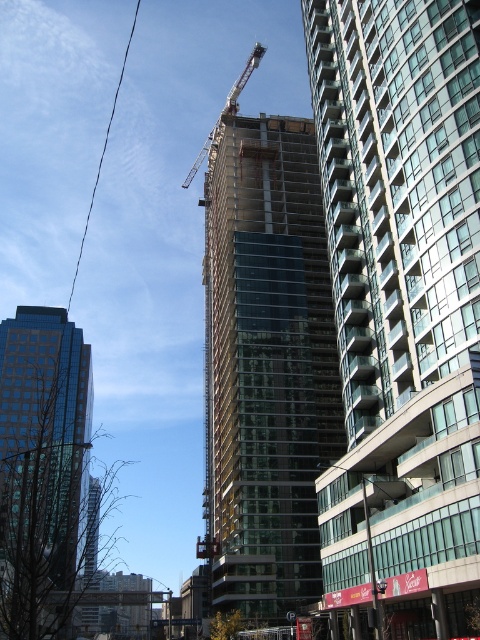
Question: Which of these objects is positioned farthest from the transparent glass building at center?

Choices:
 (A) shiny glass skyscraper at left
 (B) metallic gray crane at upper center

Answer: (B)

Question: Observing the image, what is the correct spatial positioning of clear glass building at center in reference to shiny glass skyscraper at left?

Choices:
 (A) below
 (B) above

Answer: (B)

Question: Where is transparent glass building at center located in relation to shiny glass skyscraper at left in the image?

Choices:
 (A) right
 (B) left

Answer: (A)

Question: Which of the following is the closest to the observer?

Choices:
 (A) (32, 332)
 (B) (420, 106)
 (C) (251, 58)

Answer: (B)

Question: Does clear glass building at center have a greater width compared to transparent glass building at center?

Choices:
 (A) no
 (B) yes

Answer: (A)

Question: Which object appears closest to the camera in this image?

Choices:
 (A) shiny glass skyscraper at left
 (B) metallic gray crane at upper center
 (C) transparent glass building at center
 (D) clear glass building at center

Answer: (A)